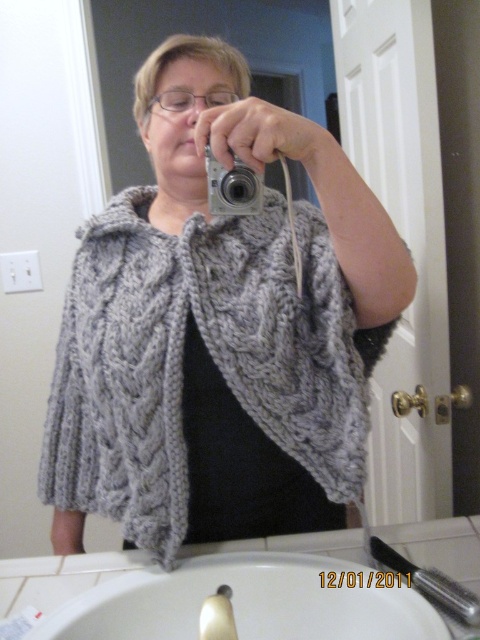
Question: Considering the real-world distances, which object is closest to the white ceramic sink at lower center?

Choices:
 (A) gray knitted scarf at center
 (B) silver metallic camera at center

Answer: (A)

Question: Does gray knitted scarf at center appear under white ceramic sink at lower center?

Choices:
 (A) yes
 (B) no

Answer: (B)

Question: Is gray knitted scarf at center bigger than silver metallic camera at center?

Choices:
 (A) yes
 (B) no

Answer: (A)

Question: Which point is closer to the camera?

Choices:
 (A) white ceramic sink at lower center
 (B) silver metallic camera at center
 (C) gray knitted scarf at center

Answer: (A)

Question: Which point is farther to the camera?

Choices:
 (A) (400, 636)
 (B) (95, 442)
 (C) (206, 161)

Answer: (B)

Question: Can you confirm if gray knitted scarf at center is positioned to the right of white ceramic sink at lower center?

Choices:
 (A) yes
 (B) no

Answer: (B)